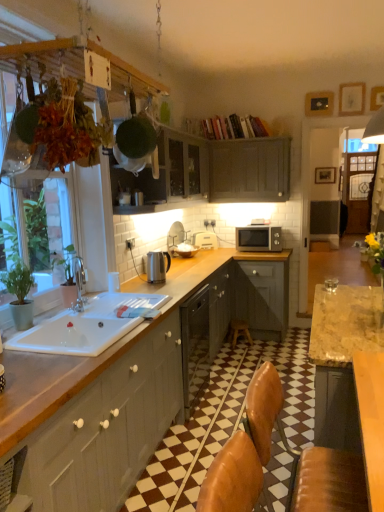
Question: From a real-world perspective, is white plastic toaster at upper center, which is the second appliance from bottom to top, physically located above or below green matte plant hanger at upper left?

Choices:
 (A) above
 (B) below

Answer: (B)

Question: From the image's perspective, is white plastic toaster at upper center, which ranks as the second appliance in front-to-back order, above or below green matte plant hanger at upper left?

Choices:
 (A) below
 (B) above

Answer: (A)

Question: Considering the real-world distances, which object is farthest from the matte gray cabinet at upper center, the 2th cabinetry when ordered from top to bottom?

Choices:
 (A) green matte plant hanger at upper left
 (B) wooden stool at center
 (C) white ceramic sink at lower left
 (D) wooden picture frame at upper right
 (E) white plastic toaster at upper center, which is the second appliance from bottom to top

Answer: (A)

Question: Which object is the closest to the wooden picture frame at upper right?

Choices:
 (A) matte gray cabinet at upper center, the 2th cabinetry when ordered from top to bottom
 (B) green matte plant hanger at upper left
 (C) satin silver kettle at counter, the 2th appliance when ordered from right to left
 (D) white ceramic sink at lower left
 (E) matte gray cabinet at upper center, which is the 1th cabinetry in top-to-bottom order

Answer: (E)